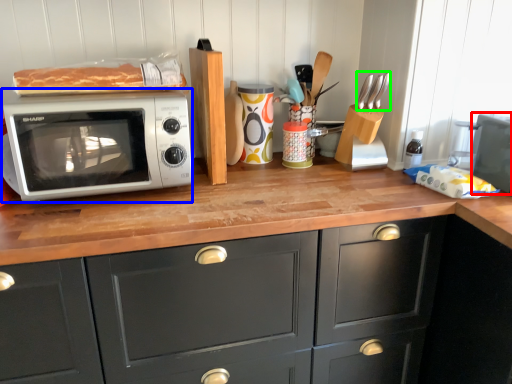
Question: Which object is positioned closest to appliance (highlighted by a red box)? Select from microwave oven (highlighted by a blue box) and silverware (highlighted by a green box).

Choices:
 (A) microwave oven
 (B) silverware

Answer: (B)